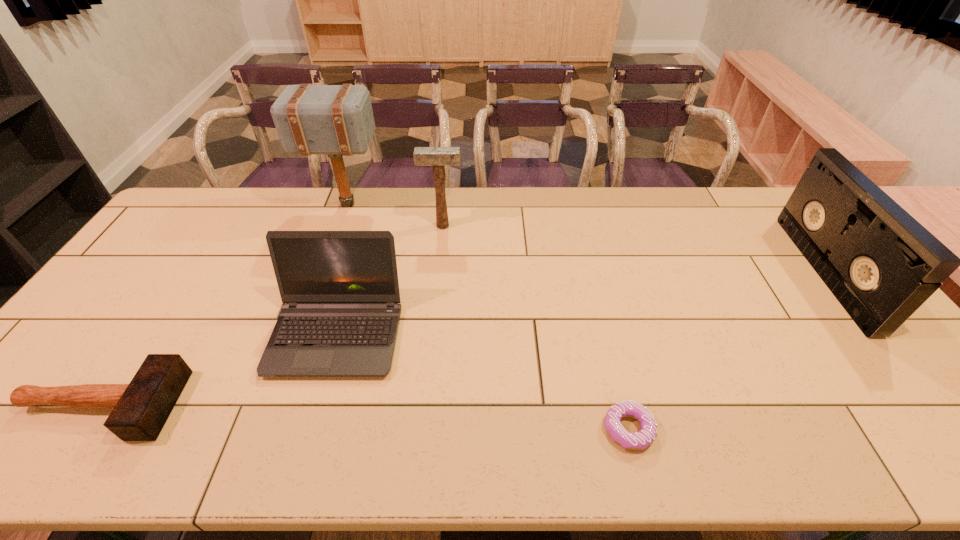
Where is `free space located 0.070m on the front side of the videotape`? This screenshot has height=540, width=960. free space located 0.070m on the front side of the videotape is located at coordinates (793, 272).

Image resolution: width=960 pixels, height=540 pixels. Find the location of `vacant space situated on the front side of the videotape`. vacant space situated on the front side of the videotape is located at coordinates (695, 272).

Locate an element on the screen. The image size is (960, 540). vacant space located on the front side of the videotape is located at coordinates tap(783, 272).

You are a GUI agent. You are given a task and a screenshot of the screen. Output one action in this format:
    pyautogui.click(x=<x>, y=<y>)
    Task: Click on the free region located 0.130m on the screen of the laptop_computer
    
    Given the screenshot: What is the action you would take?
    pyautogui.click(x=309, y=431)

Where is `vacant space located on the left of the doughnut`? Image resolution: width=960 pixels, height=540 pixels. vacant space located on the left of the doughnut is located at coordinates (469, 429).

Locate an element on the screen. videotape at the far edge is located at coordinates (881, 264).

The image size is (960, 540). In order to click on object located in the near edge section of the desktop in this screenshot , I will do `click(643, 438)`.

This screenshot has height=540, width=960. What are the coordinates of `object that is at the right edge` in the screenshot? It's located at (881, 264).

You are a GUI agent. You are given a task and a screenshot of the screen. Output one action in this format:
    pyautogui.click(x=<x>, y=<y>)
    Task: Click on the object positioned at the far right corner
    The image size is (960, 540).
    Given the screenshot: What is the action you would take?
    pyautogui.click(x=881, y=264)

This screenshot has width=960, height=540. I want to click on free space at the far edge of the desktop, so click(381, 218).